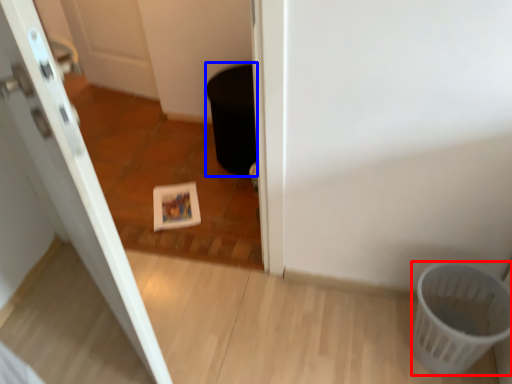
Question: Which of the following is the farthest to the observer, basket (highlighted by a red box) or potty (highlighted by a blue box)?

Choices:
 (A) basket
 (B) potty

Answer: (B)